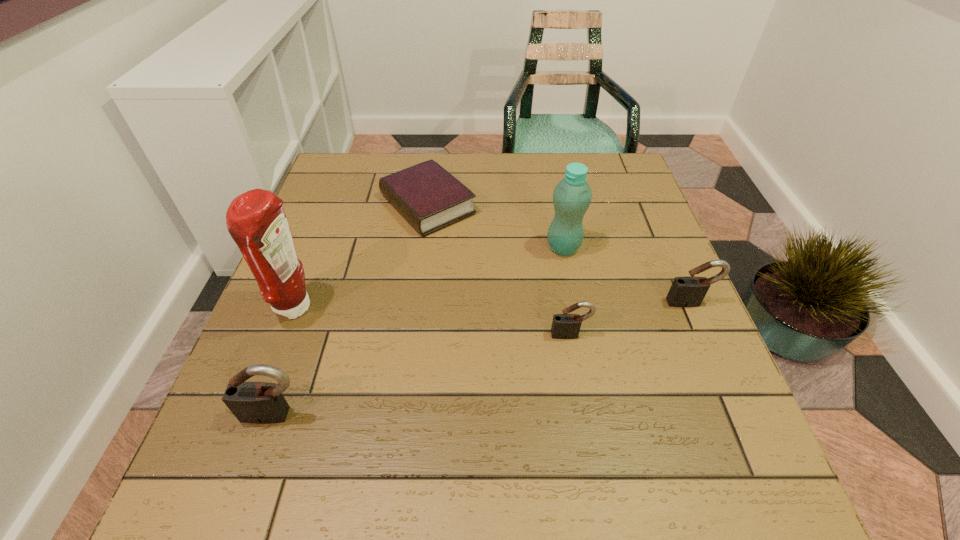
Locate an element on the screen. The width and height of the screenshot is (960, 540). vacant area that lies between the second shortest padlock and the condiment is located at coordinates (492, 305).

You are a GUI agent. You are given a task and a screenshot of the screen. Output one action in this format:
    pyautogui.click(x=<x>, y=<y>)
    Task: Click on the vacant space that is in between the fourth object from right to left and the second tallest object
    The height and width of the screenshot is (540, 960).
    Given the screenshot: What is the action you would take?
    pyautogui.click(x=495, y=226)

Locate an element on the screen. unoccupied position between the condiment and the fifth tallest object is located at coordinates (433, 321).

The height and width of the screenshot is (540, 960). I want to click on vacant area between the tallest object and the water bottle, so click(429, 278).

Identify the location of empty location between the rightmost padlock and the fourth shortest object. (483, 358).

This screenshot has width=960, height=540. I want to click on vacant point located between the third object from left to right and the tallest object, so click(x=361, y=256).

Identify the location of unoccupied area between the shortest object and the tallest object. (361, 256).

The height and width of the screenshot is (540, 960). I want to click on free space between the water bottle and the rightmost padlock, so click(627, 275).

Find the location of `free space that is in between the tallest object and the water bottle`. free space that is in between the tallest object and the water bottle is located at coordinates (429, 278).

At what (x,y) coordinates should I click in order to perform the action: click on free space between the shortest object and the fifth shortest object. Please return your answer as a coordinate pair (x, y). Looking at the image, I should click on (495, 226).